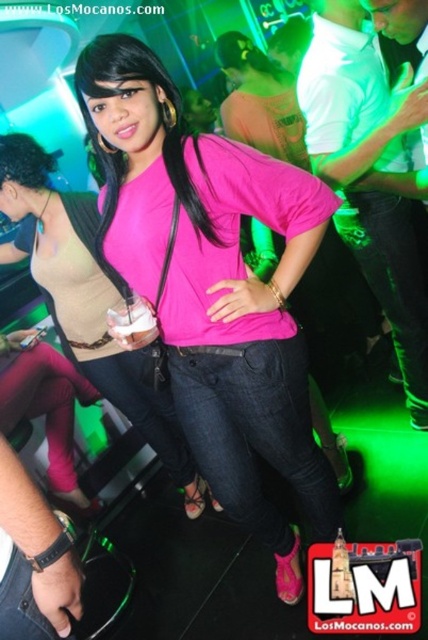
You are a photographer at the nightclub scene. You notice two pink shirts in the image, the matte pink shirt at center and the pink matte shirt at center. Which one appears smaller in size?

The matte pink shirt at center is smaller than the pink matte shirt at center according to the description.

In the scene shown: You are a photographer at the nightclub. You want to take a photo of the white cotton shirt at upper right without the matte pink shirt at center blocking it. How should you adjust your position?

Move your camera position to the left or right so that the white cotton shirt at upper right is no longer behind the matte pink shirt at center.